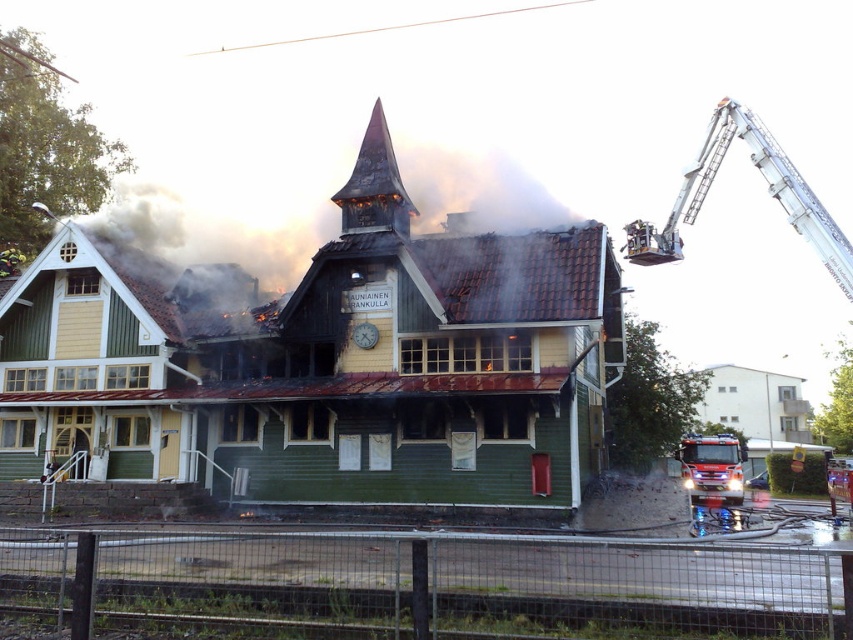
At what (x,y) coordinates should I click in order to perform the action: click on silver metallic crane at upper right. Please return your answer as a coordinate pair (x, y). The image size is (853, 640). Looking at the image, I should click on (767, 189).

Is point (379, 113) positioned after point (724, 445)?

No.

Measure the distance between point (366, 180) and camera.

Point (366, 180) is 25.61 meters away from camera.

The image size is (853, 640). Find the location of `charred wood spire at center`. charred wood spire at center is located at coordinates (374, 184).

Does silver metallic crane at upper right have a smaller size compared to shiny metallic fire truck at lower right?

Actually, silver metallic crane at upper right might be larger than shiny metallic fire truck at lower right.

Which is below, silver metallic crane at upper right or shiny metallic fire truck at lower right?

shiny metallic fire truck at lower right

Is point (757, 144) less distant than point (715, 516)?

No.

Find the location of `silver metallic crane at upper right`. silver metallic crane at upper right is located at coordinates (767, 189).